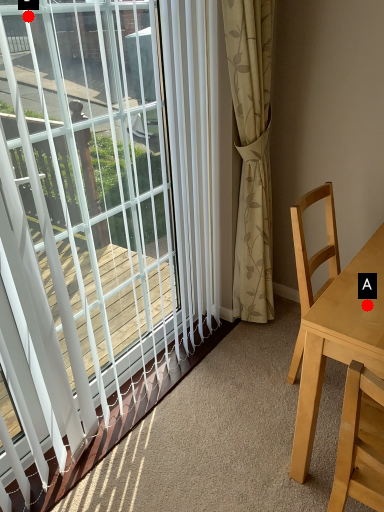
Question: Two points are circled on the image, labeled by A and B beside each circle. Which of the following is the farthest from the observer?

Choices:
 (A) A is further
 (B) B is further

Answer: (A)